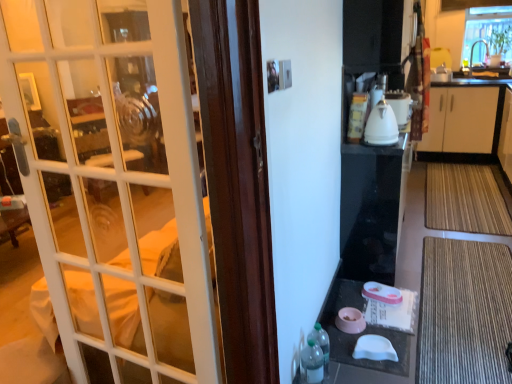
Question: Considering their positions, is brown textured mat at lower right, acting as the second doormat starting from the back, located in front of or behind clear glass window at upper right?

Choices:
 (A) behind
 (B) front

Answer: (B)

Question: Does point (446, 249) appear closer or farther from the camera than point (475, 6)?

Choices:
 (A) farther
 (B) closer

Answer: (B)

Question: Which object is the farthest from the white glossy kettle at upper right?

Choices:
 (A) pink plastic table at lower center
 (B) translucent plastic bottle at lower right, which is the first bottle from front to back
 (C) white glossy kettle at upper right
 (D) bamboo mat at lower right, placed as the 1th doormat when sorted from top to bottom
 (E) clear glass window at upper right

Answer: (E)

Question: Which is nearer to the white glass door at left?

Choices:
 (A) white glossy kettle at upper right
 (B) translucent plastic bottle at lower right, the 2th bottle from the back
 (C) pink plastic table at lower center
 (D) clear glass window at upper right
 (E) translucent plastic bottle at lower right, the 1th bottle positioned from the back

Answer: (B)